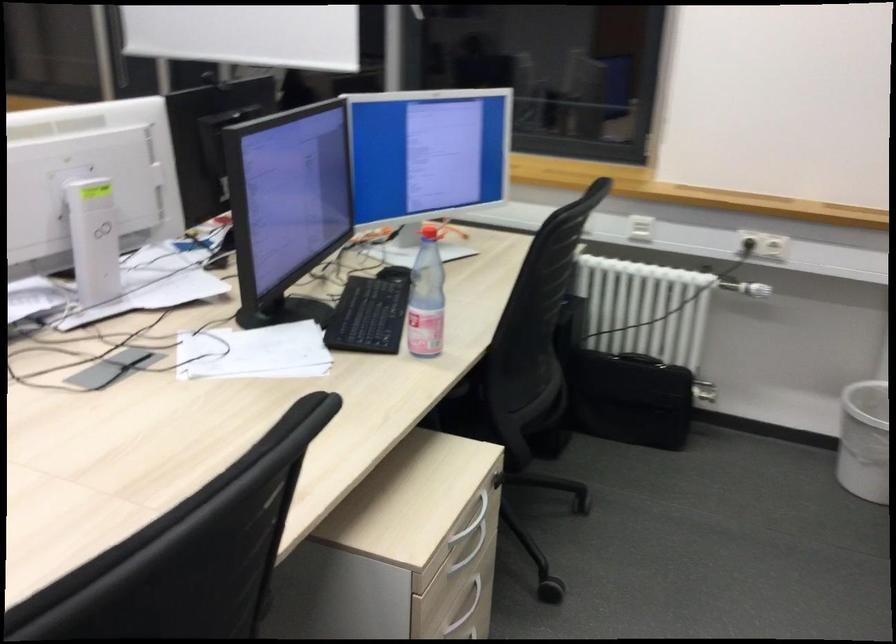
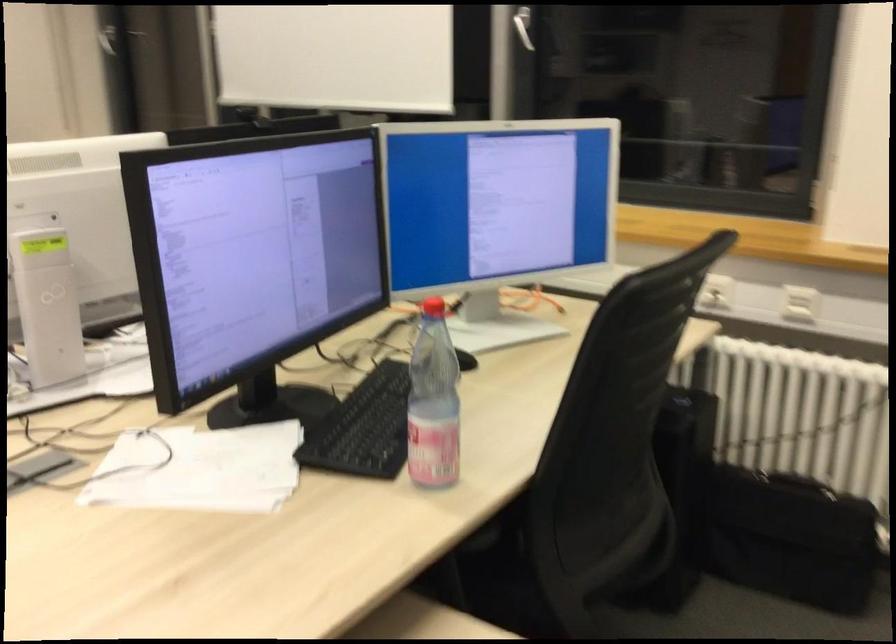
The point at (252, 355) is marked in the first image. Where is the corresponding point in the second image?

(199, 469)